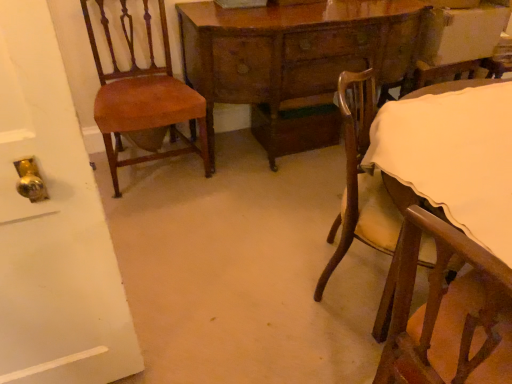
Locate an element on the screen. The height and width of the screenshot is (384, 512). free space in front of wooden table at center is located at coordinates (260, 223).